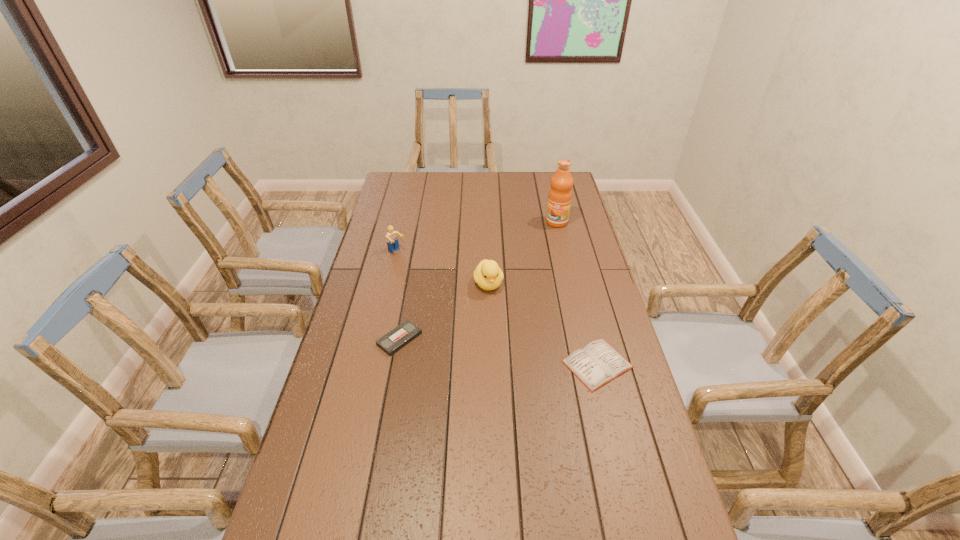
Find the location of a particular element. vacant area in the image that satisfies the following two spatial constraints: 1. on the back side of the Lego; 2. on the left side of the farthest object is located at coordinates (x=404, y=222).

You are a GUI agent. You are given a task and a screenshot of the screen. Output one action in this format:
    pyautogui.click(x=<x>, y=<y>)
    Task: Click on the vacant position in the image that satisfies the following two spatial constraints: 1. on the front side of the diary; 2. on the left side of the second farthest object
    The height and width of the screenshot is (540, 960).
    Given the screenshot: What is the action you would take?
    pyautogui.click(x=372, y=364)

You are a GUI agent. You are given a task and a screenshot of the screen. Output one action in this format:
    pyautogui.click(x=<x>, y=<y>)
    Task: Click on the vacant point that satisfies the following two spatial constraints: 1. on the back side of the third object from left to right; 2. on the left side of the videotape
    The width and height of the screenshot is (960, 540).
    Given the screenshot: What is the action you would take?
    pyautogui.click(x=409, y=284)